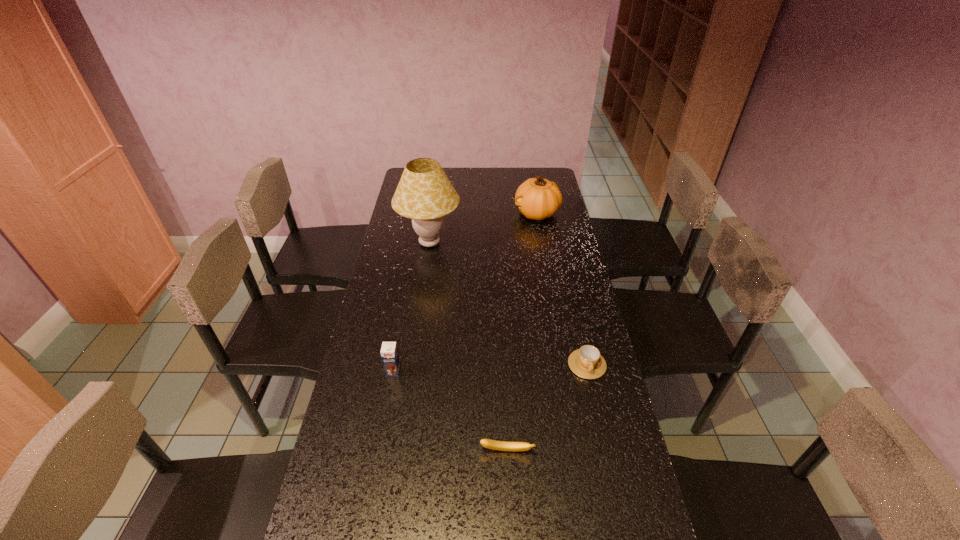
Locate an element on the screen. lampshade is located at coordinates (424, 194).

You are a GUI agent. You are given a task and a screenshot of the screen. Output one action in this format:
    pyautogui.click(x=<x>, y=<y>)
    Task: Click on the fourth shortest object
    This screenshot has width=960, height=540.
    Given the screenshot: What is the action you would take?
    pyautogui.click(x=537, y=198)

This screenshot has width=960, height=540. In order to click on chocolate milk in this screenshot , I will do `click(389, 353)`.

Locate an element on the screen. The height and width of the screenshot is (540, 960). cup is located at coordinates (586, 362).

Find the location of a particular element. The image size is (960, 540). banana is located at coordinates (487, 443).

I want to click on the nearest object, so click(x=487, y=443).

At what (x,y) coordinates should I click in order to perform the action: click on vacant space located 0.240m on the front of the lampshade. Please return your answer as a coordinate pair (x, y). Image resolution: width=960 pixels, height=540 pixels. Looking at the image, I should click on (420, 307).

The width and height of the screenshot is (960, 540). In order to click on vacant space situated 0.230m on the front face of the pumpkin in this screenshot , I will do `click(463, 214)`.

Where is `free spot located on the front face of the pumpkin`? This screenshot has height=540, width=960. free spot located on the front face of the pumpkin is located at coordinates (444, 214).

Locate an element on the screen. vacant space situated 0.260m on the front face of the pumpkin is located at coordinates (456, 214).